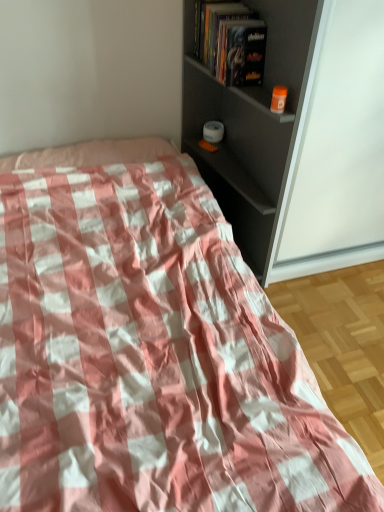
Question: Does matte gray shelf at upper right have a lesser width compared to pink checkered fabric at center?

Choices:
 (A) yes
 (B) no

Answer: (A)

Question: Is matte gray shelf at upper right oriented towards pink checkered fabric at center?

Choices:
 (A) no
 (B) yes

Answer: (B)

Question: Is matte gray shelf at upper right beside pink checkered fabric at center?

Choices:
 (A) no
 (B) yes

Answer: (A)

Question: Does matte gray shelf at upper right have a larger size compared to pink checkered fabric at center?

Choices:
 (A) yes
 (B) no

Answer: (B)

Question: Does matte gray shelf at upper right have a lesser height compared to pink checkered fabric at center?

Choices:
 (A) yes
 (B) no

Answer: (B)

Question: Can you confirm if matte gray shelf at upper right is taller than pink checkered fabric at center?

Choices:
 (A) yes
 (B) no

Answer: (A)

Question: From a real-world perspective, is matte gray shelf at upper right positioned under hardcover book at upper center based on gravity?

Choices:
 (A) no
 (B) yes

Answer: (B)

Question: Would you say matte gray shelf at upper right is a long distance from hardcover book at upper center?

Choices:
 (A) yes
 (B) no

Answer: (B)

Question: Can we say matte gray shelf at upper right lies outside hardcover book at upper center?

Choices:
 (A) no
 (B) yes

Answer: (B)

Question: Is matte gray shelf at upper right placed right next to hardcover book at upper center?

Choices:
 (A) yes
 (B) no

Answer: (B)

Question: Is matte gray shelf at upper right surrounding hardcover book at upper center?

Choices:
 (A) no
 (B) yes

Answer: (B)

Question: From a real-world perspective, is matte gray shelf at upper right physically above hardcover book at upper center?

Choices:
 (A) no
 (B) yes

Answer: (A)

Question: Is hardcover book at upper center not near matte gray shelf at upper right?

Choices:
 (A) no
 (B) yes

Answer: (A)